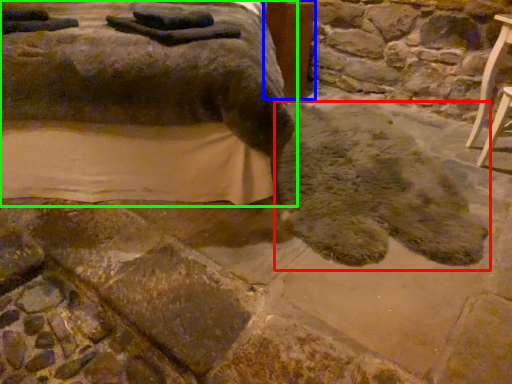
Question: Which object is the closest to the footprint (highlighted by a red box)? Choose among these: table (highlighted by a blue box) or furniture (highlighted by a green box).

Choices:
 (A) table
 (B) furniture

Answer: (B)